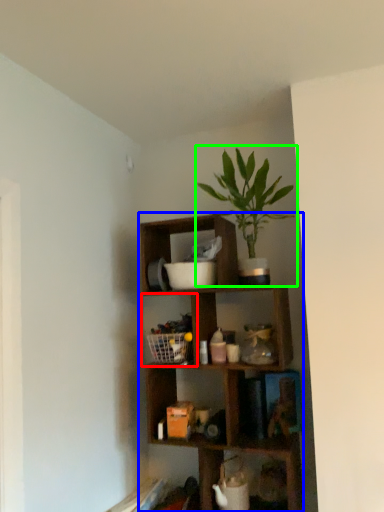
Question: Based on their relative distances, which object is farther from cabinet (highlighted by a red box)? Choose from shelf (highlighted by a blue box) and houseplant (highlighted by a green box).

Choices:
 (A) shelf
 (B) houseplant

Answer: (B)